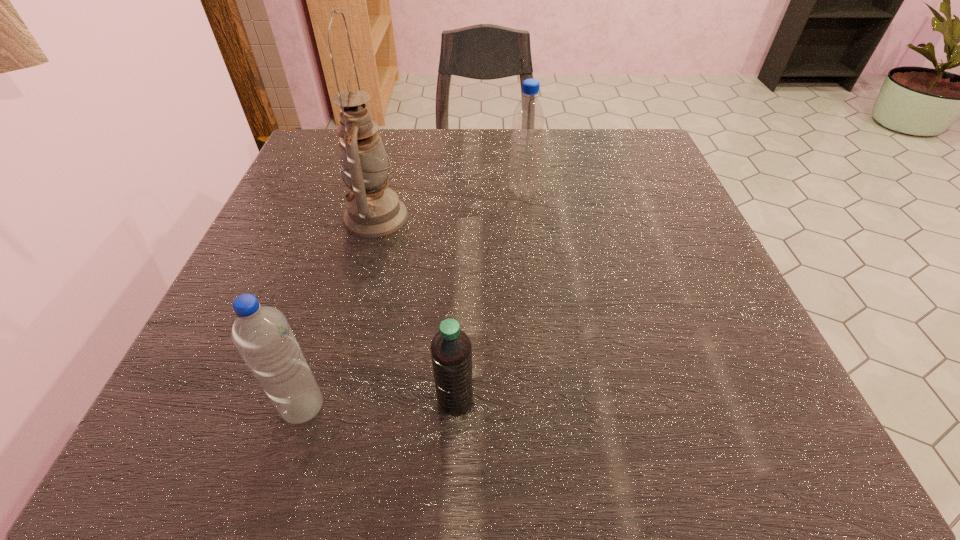
I want to click on object that is at the far edge, so click(x=528, y=120).

At what (x,y) coordinates should I click in order to perform the action: click on oil lamp that is positioned at the left edge. Please return your answer as a coordinate pair (x, y). Looking at the image, I should click on (373, 210).

The height and width of the screenshot is (540, 960). In order to click on water bottle that is at the left edge in this screenshot , I will do `click(262, 335)`.

Find the location of a particular element. The width and height of the screenshot is (960, 540). object situated at the near left corner is located at coordinates (262, 335).

This screenshot has width=960, height=540. Identify the location of blank space at the far edge of the desktop. (579, 145).

This screenshot has width=960, height=540. In the image, there is a desktop. Identify the location of vacant space at the near edge. (390, 430).

At what (x,y) coordinates should I click in order to perform the action: click on vacant space at the right edge of the desktop. Please return your answer as a coordinate pair (x, y). Looking at the image, I should click on (669, 247).

The height and width of the screenshot is (540, 960). In order to click on free spot at the near left corner of the desktop in this screenshot , I will do `click(255, 454)`.

Identify the location of vacant space at the far right corner of the desktop. (639, 168).

Find the location of a particular element. The image size is (960, 540). free space between the leftmost water bottle and the rightmost water bottle is located at coordinates (413, 299).